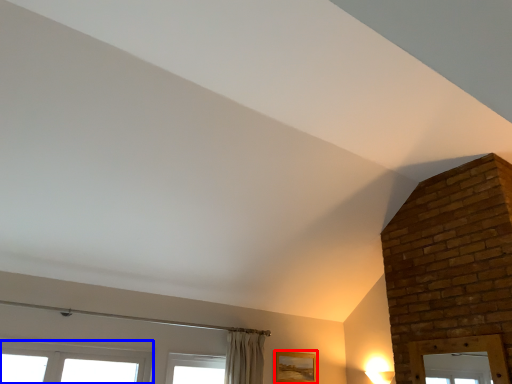
Question: Which point is closer to the camera, picture frame (highlighted by a red box) or window (highlighted by a blue box)?

Choices:
 (A) picture frame
 (B) window

Answer: (B)